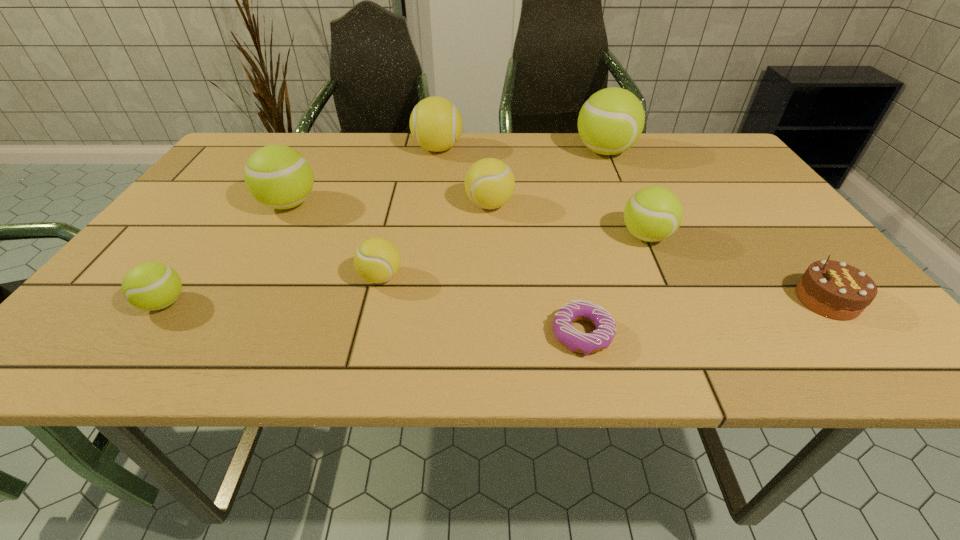
Locate an element on the screen. Image resolution: width=960 pixels, height=540 pixels. free space that is in between the nearest green tennis ball and the second smallest green tennis ball is located at coordinates (405, 270).

Identify the location of unoccupied position between the sixth tennis ball from right to left and the leftmost object. (227, 254).

This screenshot has height=540, width=960. What are the coordinates of `free space between the rightmost object and the third green tennis ball from right to left` in the screenshot? It's located at (558, 252).

In order to click on object that is the closest one to the second farthest yellow tennis ball in this screenshot , I will do `click(436, 124)`.

Locate which object is the seventh closest to the nearest green tennis ball. Please provide its 2D coordinates. Your answer should be formatted as a tuple, i.e. [(x, y)], where the tuple contains the x and y coordinates of a point satisfying the conditions above.

[(611, 121)]

Where is `tennis ball that stands as the fifth closest to the smallest yellow tennis ball`? The width and height of the screenshot is (960, 540). tennis ball that stands as the fifth closest to the smallest yellow tennis ball is located at coordinates (652, 214).

Locate an element on the screen. This screenshot has width=960, height=540. tennis ball object that ranks as the third closest to the nearest yellow tennis ball is located at coordinates (151, 286).

Locate an element on the screen. This screenshot has height=540, width=960. the closest green tennis ball relative to the brown chocolate cake is located at coordinates (652, 214).

Identify the location of the closest green tennis ball relative to the third smallest green tennis ball. (151, 286).

Identify which yellow tennis ball is located as the second nearest to the farthest yellow tennis ball. Please provide its 2D coordinates. Your answer should be formatted as a tuple, i.e. [(x, y)], where the tuple contains the x and y coordinates of a point satisfying the conditions above.

[(377, 260)]